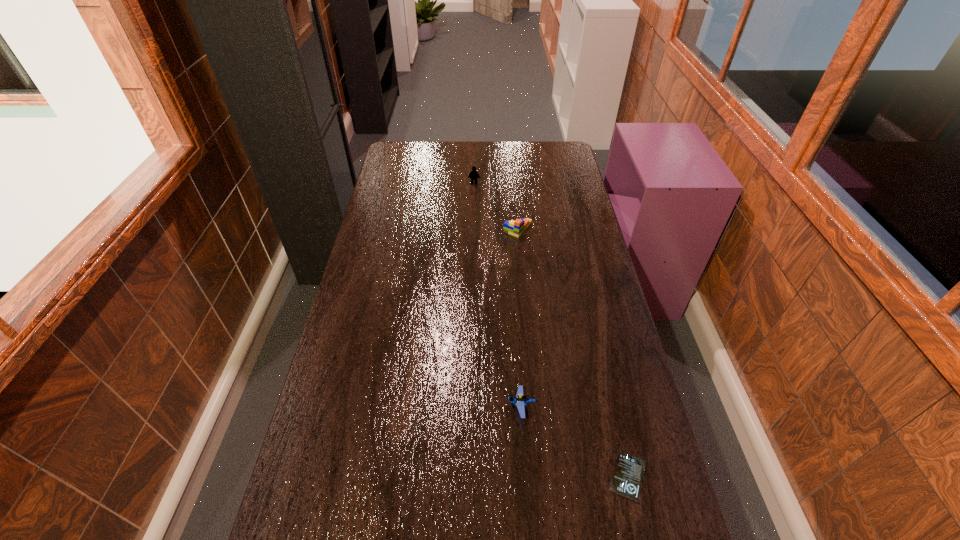
Point out which object is positioned as the nearest to the rightmost object. Please provide its 2D coordinates. Your answer should be formatted as a tuple, i.e. [(x, y)], where the tuple contains the x and y coordinates of a point satisfying the conditions above.

[(520, 400)]

Identify the location of object that is the closest one to the nearest object. This screenshot has width=960, height=540. (520, 400).

Identify which Lego is the closest to the shortest Lego. Please provide its 2D coordinates. Your answer should be formatted as a tuple, i.e. [(x, y)], where the tuple contains the x and y coordinates of a point satisfying the conditions above.

[(516, 228)]

Identify which Lego is the second closest to the rightmost object. Please provide its 2D coordinates. Your answer should be formatted as a tuple, i.e. [(x, y)], where the tuple contains the x and y coordinates of a point satisfying the conditions above.

[(516, 228)]

In order to click on vacant position in the image that satisfies the following two spatial constraints: 1. on the front-facing side of the shortest Lego; 2. on the left side of the rightmost object in this screenshot , I will do `click(525, 477)`.

Identify the location of vacant space that satisfies the following two spatial constraints: 1. on the front-facing side of the second shortest object; 2. on the back side of the identity card. (525, 477).

The height and width of the screenshot is (540, 960). In order to click on vacant point that satisfies the following two spatial constraints: 1. on the face of the nearest object; 2. on the right side of the leftmost Lego in this screenshot , I will do `click(469, 477)`.

Locate an element on the screen. vacant region that satisfies the following two spatial constraints: 1. on the face of the tallest object; 2. on the right side of the second tallest object is located at coordinates (473, 229).

Find the location of a particular element. The height and width of the screenshot is (540, 960). vacant area in the image that satisfies the following two spatial constraints: 1. on the face of the tallest Lego; 2. on the left side of the third shortest object is located at coordinates (473, 229).

I want to click on free spot that satisfies the following two spatial constraints: 1. on the face of the second nearest Lego; 2. on the right side of the leftmost Lego, so click(x=473, y=229).